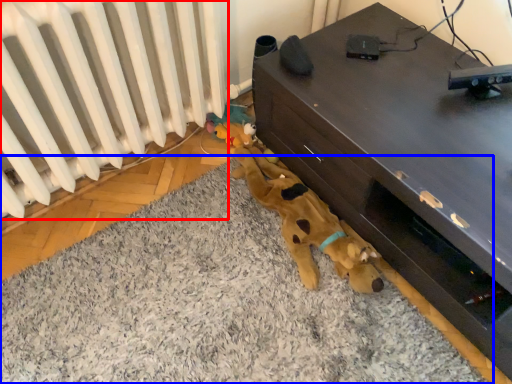
Question: Which object appears closest to the camera in this image, radiator (highlighted by a red box) or mat (highlighted by a blue box)?

Choices:
 (A) radiator
 (B) mat

Answer: (B)